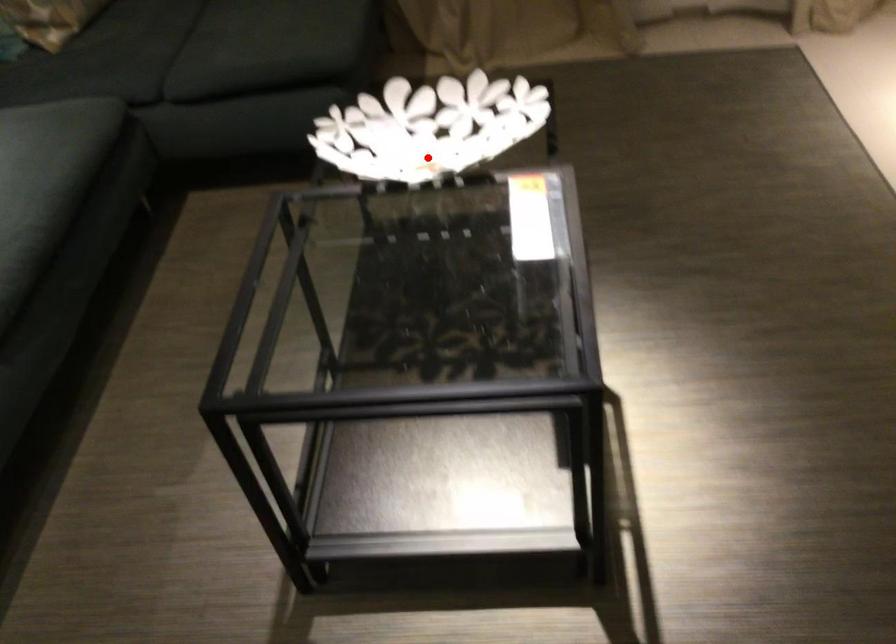
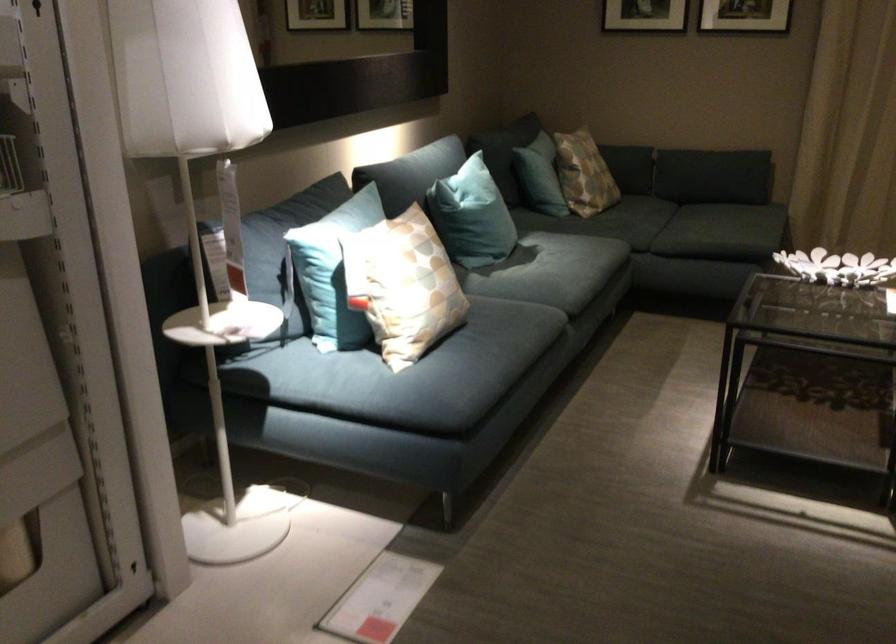
Question: A red point is marked in image1. In image2, is the corresponding 3D point closer to the camera or farther? Reply with the corresponding letter.

Choices:
 (A) The corresponding 3D point is closer.
 (B) The corresponding 3D point is farther.

Answer: (B)